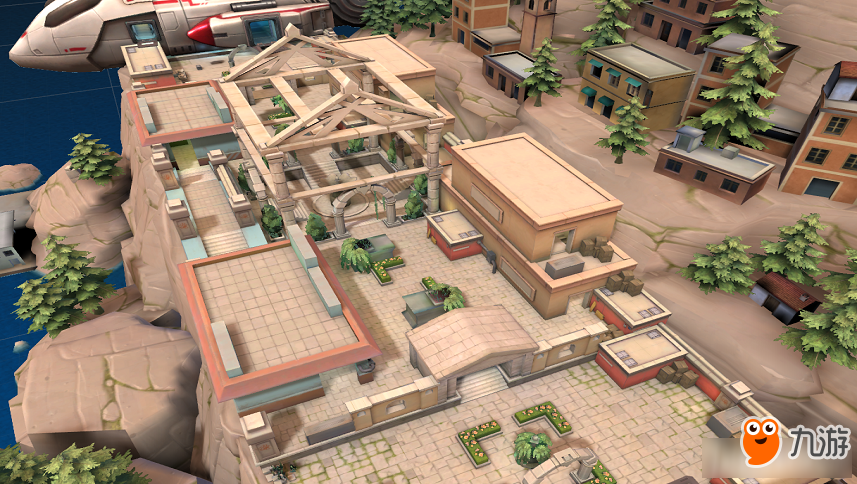
What are the coordinates of `plant` in the screenshot? It's located at (531, 443), (350, 250).